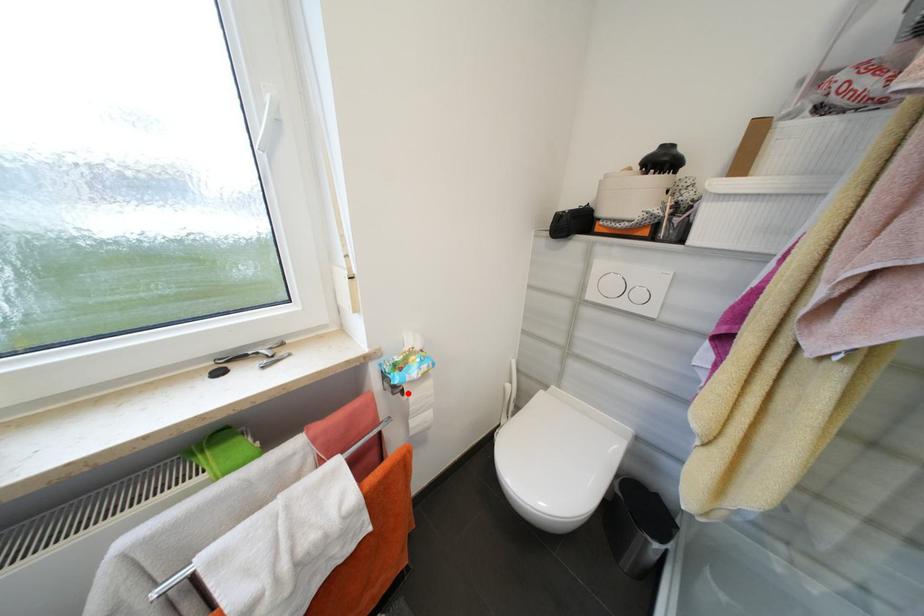
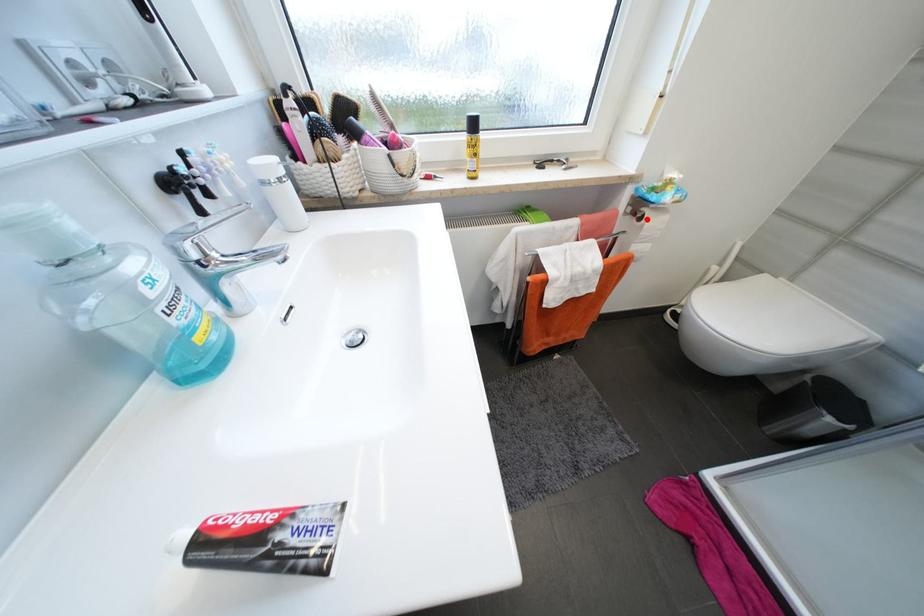
I am providing you with two images of the same scene from different viewpoints. A red point is marked on the first image and another point is marked on the second image. Is the marked point in image1 the same physical position as the marked point in image2?

Yes